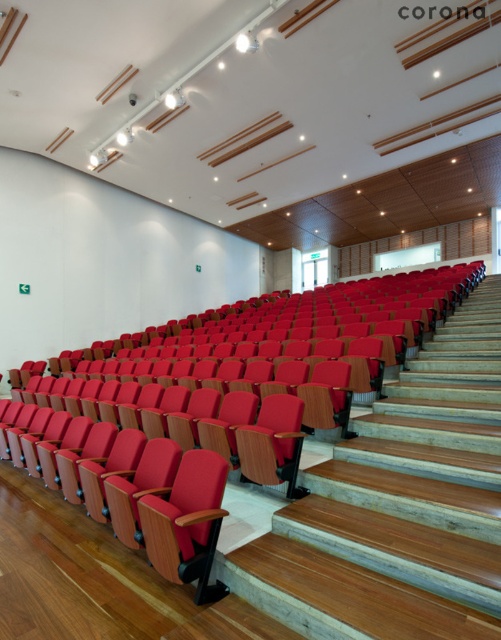
Does wooden at center have a greater width compared to matte red seat at center?

Yes, wooden at center is wider than matte red seat at center.

Measure the distance between wooden at center and matte red seat at center.

A distance of 25.29 inches exists between wooden at center and matte red seat at center.

This screenshot has width=501, height=640. Find the location of `wooden at center`. wooden at center is located at coordinates (398, 506).